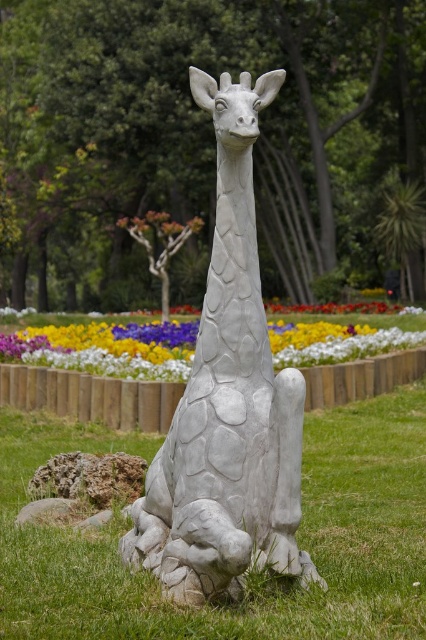
Is the position of green grass at lower center more distant than that of white stone giraffe at center?

Yes, green grass at lower center is behind white stone giraffe at center.

Based on the photo, which of these two, green grass at lower center or white stone giraffe at center, stands shorter?

green grass at lower center is shorter.

Who is more forward, (412, 556) or (224, 216)?

Point (224, 216) is in front.

Identify the location of green grass at lower center. The width and height of the screenshot is (426, 640). (255, 580).

Is white stone giraffe at center behind vibrant multicolored petals at center?

No, white stone giraffe at center is closer to the viewer.

Consider the image. Is white stone giraffe at center to the left of vibrant multicolored petals at center from the viewer's perspective?

In fact, white stone giraffe at center is to the right of vibrant multicolored petals at center.

Who is more distant from viewer, (192, 93) or (43, 362)?

Positioned behind is point (43, 362).

At what (x,y) coordinates should I click in order to perform the action: click on white stone giraffe at center. Please return your answer as a coordinate pair (x, y). Looking at the image, I should click on click(227, 401).

Is green grass at lower center shorter than vibrant multicolored petals at center?

Yes.

Between point (23, 436) and point (123, 348), which one is positioned behind?

Positioned behind is point (123, 348).

Find the location of a particular element. The image size is (426, 640). green grass at lower center is located at coordinates (255, 580).